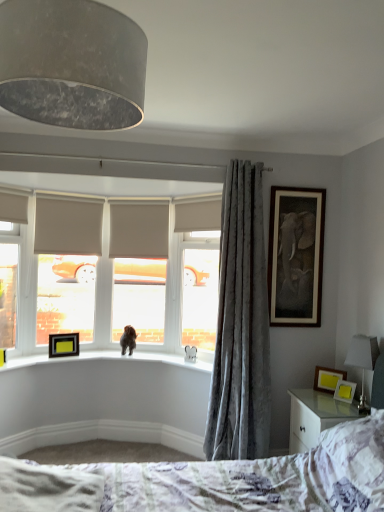
Question: Looking at the image, does black matte picture frame at upper left, marked as the 3th picture frame in a bottom-to-top arrangement, seem bigger or smaller compared to matte gray lampshade at upper left?

Choices:
 (A) small
 (B) big

Answer: (A)

Question: Is black matte picture frame at upper left, which ranks as the fourth picture frame in right-to-left order, in front of or behind matte gray lampshade at upper left in the image?

Choices:
 (A) front
 (B) behind

Answer: (B)

Question: Estimate the real-world distances between objects in this image. Which object is farther from the fluffy white bed at lower center?

Choices:
 (A) white fabric lampshade at right
 (B) white textured sheet at lower left
 (C) wooden-framed elephant artwork at upper right, placed as the second picture frame when sorted from left to right
 (D) matte yellow picture frame at lower right, which ranks as the 4th picture frame in top-to-bottom order
 (E) matte gray roller blind at center, the 1th window screen viewed from the right

Answer: (E)

Question: Estimate the real-world distances between objects in this image. Which object is closer to the white textured sheet at lower left?

Choices:
 (A) white fabric lampshade at right
 (B) fluffy white bed at lower center
 (C) brown furry dog at window, the second animal viewed from the front
 (D) matte gray lampshade at upper left
 (E) matte gray roller blind at center, the 1th window screen viewed from the right

Answer: (B)